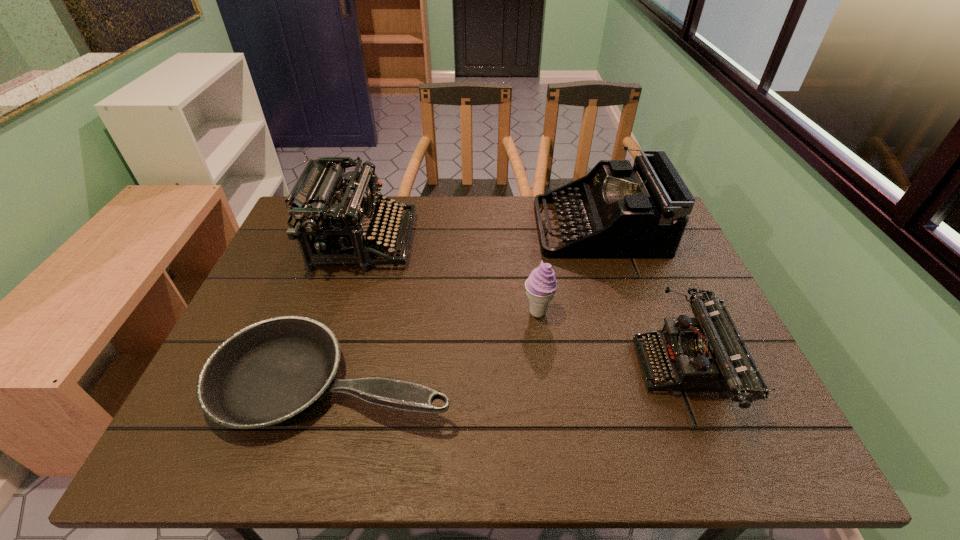
What are the coordinates of `the leftmost typewriter` in the screenshot? It's located at (336, 223).

Locate an element on the screen. The height and width of the screenshot is (540, 960). the third tallest object is located at coordinates (541, 285).

This screenshot has width=960, height=540. Find the location of `the nearest typewriter`. the nearest typewriter is located at coordinates (707, 353).

The image size is (960, 540). I want to click on the fourth tallest object, so click(707, 353).

This screenshot has height=540, width=960. In order to click on the shortest object in this screenshot , I will do `click(271, 371)`.

Locate an element on the screen. Image resolution: width=960 pixels, height=540 pixels. blank area located 0.360m on the typing side of the leftmost typewriter is located at coordinates [x=532, y=241].

Locate an element on the screen. This screenshot has width=960, height=540. vacant space located 0.340m on the front of the third tallest object is located at coordinates (557, 458).

At what (x,y) coordinates should I click in order to perform the action: click on vacant space located 0.350m on the keyboard of the shortest typewriter. Please return your answer as a coordinate pair (x, y). The width and height of the screenshot is (960, 540). Looking at the image, I should click on (484, 369).

Image resolution: width=960 pixels, height=540 pixels. What are the coordinates of `vacant position located 0.090m on the keyboard of the shortest typewriter` in the screenshot? It's located at (599, 369).

Where is `vacant space located 0.150m on the keyboard of the shortest typewriter`? The height and width of the screenshot is (540, 960). vacant space located 0.150m on the keyboard of the shortest typewriter is located at coordinates (572, 369).